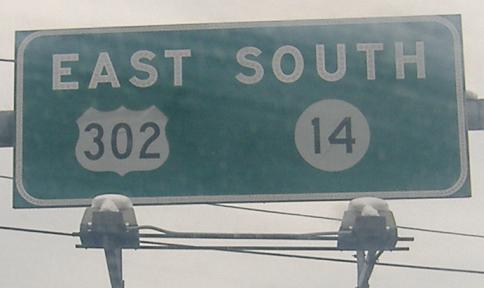
Image resolution: width=484 pixels, height=288 pixels. In order to click on lights in this screenshot , I will do `click(117, 227)`, `click(374, 227)`.